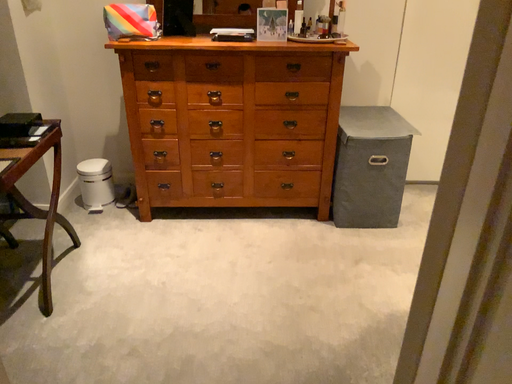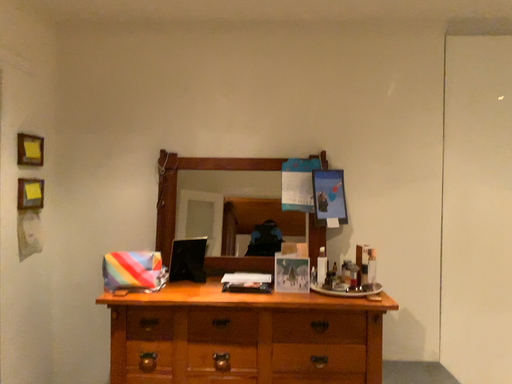
Question: Which way did the camera rotate in the video?

Choices:
 (A) rotated upward
 (B) rotated downward

Answer: (A)